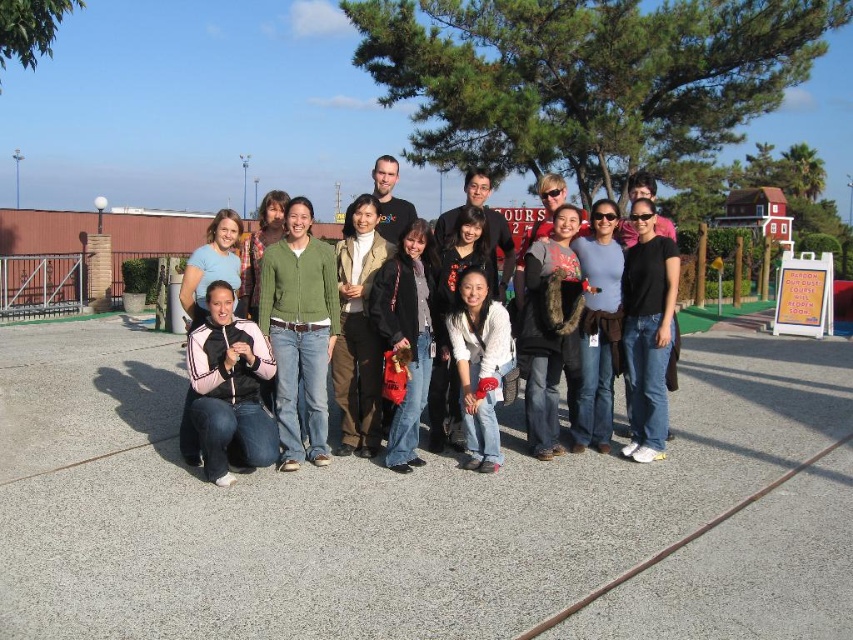
Describe the element at coordinates (532, 227) in the screenshot. I see `matte black jacket at center` at that location.

Does matte black jacket at center appear on the right side of white matte jacket at center?

Correct, you'll find matte black jacket at center to the right of white matte jacket at center.

What do you see at coordinates (532, 227) in the screenshot? The image size is (853, 640). I see `matte black jacket at center` at bounding box center [532, 227].

Identify the location of matte black jacket at center. (532, 227).

Can you confirm if white matte jacket at center is shorter than floral fabric shirt at center?

Correct, white matte jacket at center is not as tall as floral fabric shirt at center.

Is white matte jacket at center below floral fabric shirt at center?

Correct, white matte jacket at center is located below floral fabric shirt at center.

Image resolution: width=853 pixels, height=640 pixels. Find the location of `white matte jacket at center`. white matte jacket at center is located at coordinates (479, 365).

You are a GUI agent. You are given a task and a screenshot of the screen. Output one action in this format:
    pyautogui.click(x=<x>, y=<y>)
    Task: Click on the white matte jacket at center
    This screenshot has width=853, height=640.
    Given the screenshot: What is the action you would take?
    pyautogui.click(x=479, y=365)

Does matte black jacket at center lie behind floral fabric shirt at center?

That is False.

Does point (221, 243) lie behind point (508, 241)?

No.

Locate an element on the screen. This screenshot has width=853, height=640. matte black jacket at center is located at coordinates (532, 227).

You are a GUI agent. You are given a task and a screenshot of the screen. Output one action in this format:
    pyautogui.click(x=<x>, y=<y>)
    Task: Click on the matte black jacket at center
    This screenshot has width=853, height=640.
    Given the screenshot: What is the action you would take?
    pyautogui.click(x=532, y=227)